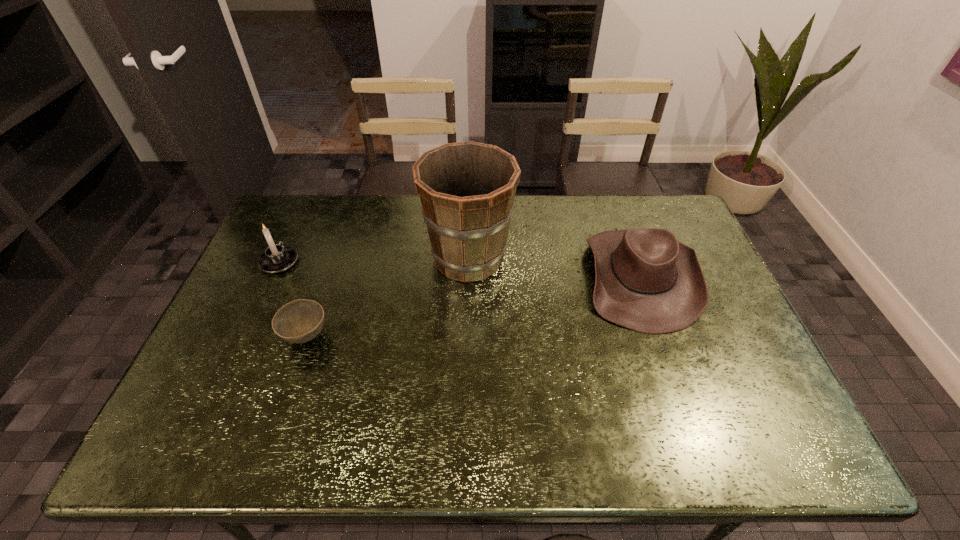
This screenshot has width=960, height=540. Find the location of `vacant region located 0.140m on the back of the rightmost object`. vacant region located 0.140m on the back of the rightmost object is located at coordinates (616, 205).

Identify the location of vacant space located 0.100m on the left of the third object from right to left. This screenshot has height=540, width=960. (245, 337).

Image resolution: width=960 pixels, height=540 pixels. Identify the location of bucket that is at the far edge. (467, 189).

Image resolution: width=960 pixels, height=540 pixels. I want to click on cowboy hat located at the far edge, so click(646, 280).

I want to click on object that is at the left edge, so click(277, 258).

Locate an element on the screen. Image resolution: width=960 pixels, height=540 pixels. object positioned at the right edge is located at coordinates (646, 280).

Find the location of `object located at the far right corner`. object located at the far right corner is located at coordinates click(x=646, y=280).

Identify the location of vacant space at the far edge of the desktop. (530, 200).

The width and height of the screenshot is (960, 540). I want to click on vacant space at the near edge, so click(x=443, y=443).

At what (x,y) coordinates should I click in order to perform the action: click on free space at the left edge of the desktop. Please return your answer as a coordinate pair (x, y). Looking at the image, I should click on (283, 285).